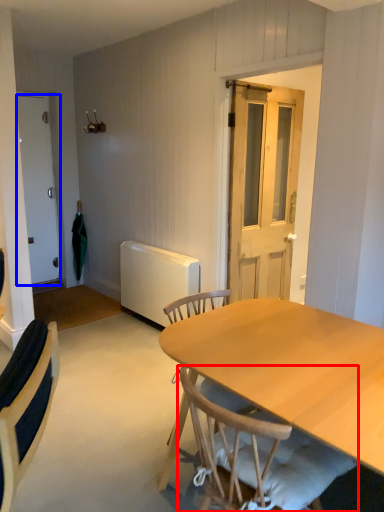
Question: Which object appears closest to the camera in this image, chair (highlighted by a red box) or door (highlighted by a blue box)?

Choices:
 (A) chair
 (B) door

Answer: (A)